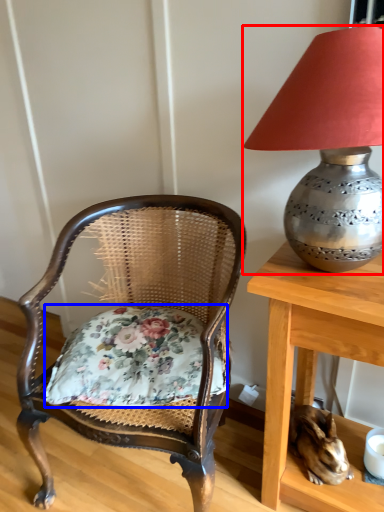
Question: Which object is closer to the camera taking this photo, lamp (highlighted by a red box) or pillow (highlighted by a blue box)?

Choices:
 (A) lamp
 (B) pillow

Answer: (A)